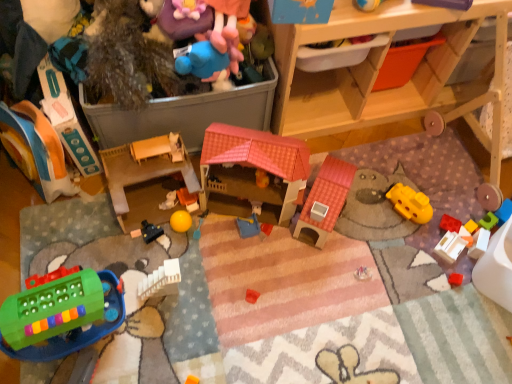
Where is `vacant space to the right of green plastic building block at lower left, positioned as the 11th toy in right-to-left order`? The height and width of the screenshot is (384, 512). vacant space to the right of green plastic building block at lower left, positioned as the 11th toy in right-to-left order is located at coordinates (151, 343).